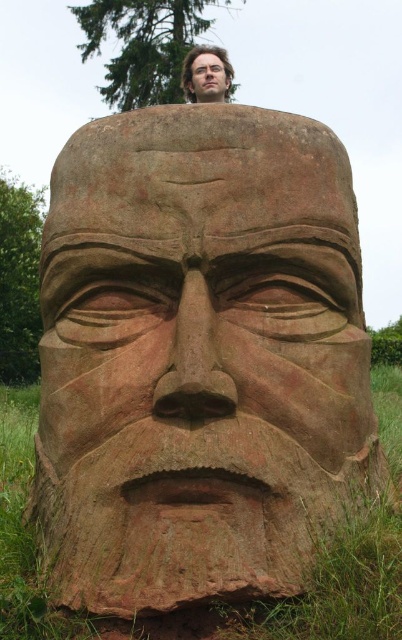
Can you confirm if smooth brown wooden head at upper center is positioned below smooth wood face at upper center?

Yes, smooth brown wooden head at upper center is below smooth wood face at upper center.

Does smooth brown wooden head at upper center appear on the right side of smooth wood face at upper center?

Correct, you'll find smooth brown wooden head at upper center to the right of smooth wood face at upper center.

Between point (221, 54) and point (203, 77), which one is positioned in front?

Point (203, 77)

You are a GUI agent. You are given a task and a screenshot of the screen. Output one action in this format:
    pyautogui.click(x=<x>, y=<y>)
    Task: Click on the smooth brown wooden head at upper center
    
    Given the screenshot: What is the action you would take?
    pyautogui.click(x=207, y=74)